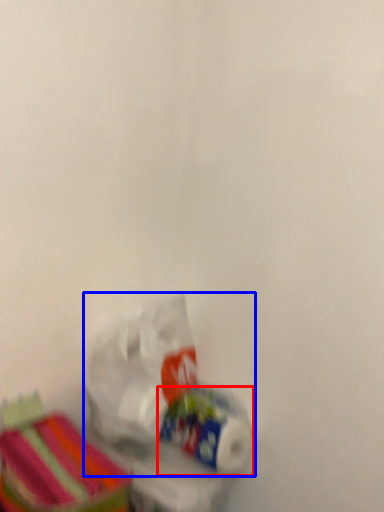
Question: Among these objects, which one is nearest to the camera, toilet paper (highlighted by a red box) or plastic bag (highlighted by a blue box)?

Choices:
 (A) toilet paper
 (B) plastic bag

Answer: (B)